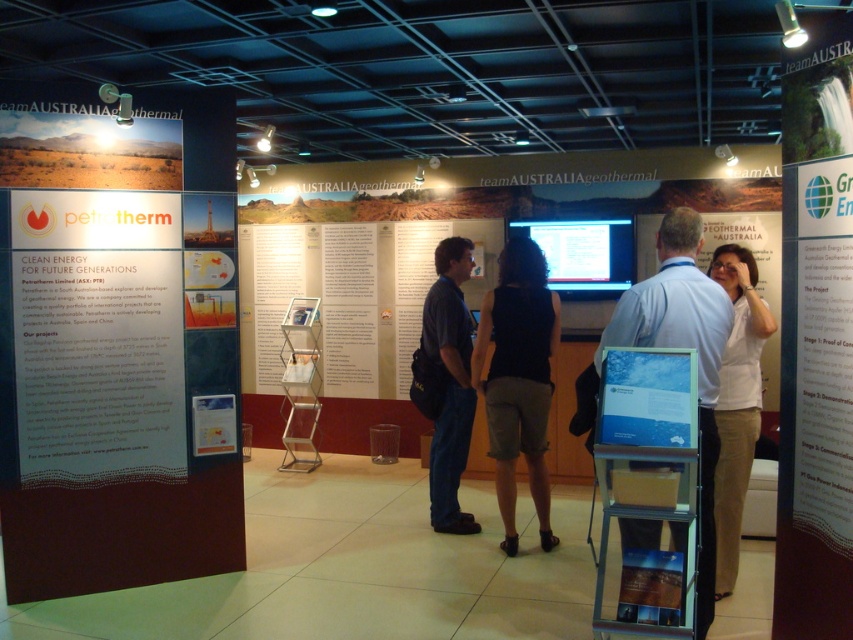
Can you confirm if white cotton shirt at right is positioned below dark blue shirt at center?

Indeed, white cotton shirt at right is positioned under dark blue shirt at center.

Who is shorter, white cotton shirt at right or dark blue shirt at center?

Standing shorter between the two is white cotton shirt at right.

Which is behind, point (749, 301) or point (438, 513)?

Point (438, 513)

What are the coordinates of `white cotton shirt at right` in the screenshot? It's located at (735, 403).

Does black fabric dress at center have a greater height compared to blue glossy poster at center?

Yes.

Is black fabric dress at center bigger than blue glossy poster at center?

Correct, black fabric dress at center is larger in size than blue glossy poster at center.

Does point (543, 448) lie behind point (621, 406)?

That is True.

Find the location of `black fabric dress at center`. black fabric dress at center is located at coordinates (518, 380).

Is dark blue shirt at center thinner than blue glossy poster at center?

Indeed, dark blue shirt at center has a lesser width compared to blue glossy poster at center.

Is dark blue shirt at center positioned before blue glossy poster at center?

No, it is not.

Where is `dark blue shirt at center`? dark blue shirt at center is located at coordinates (450, 381).